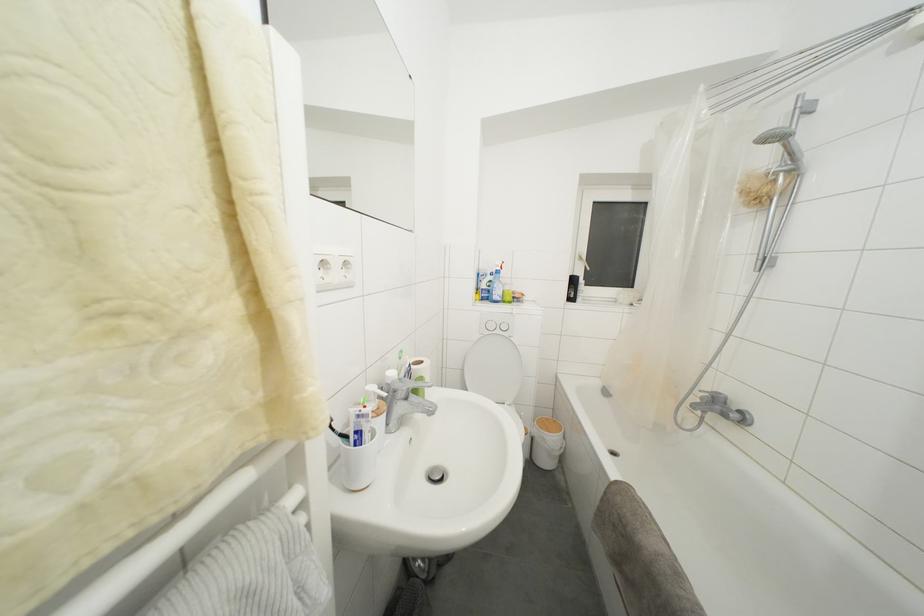
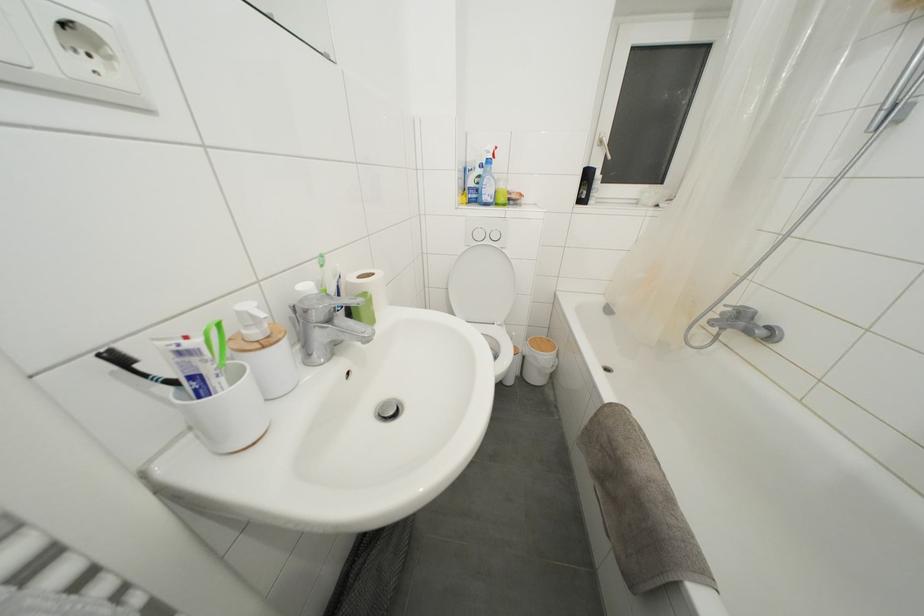
Locate, in the second image, the point that corresponds to point 406,399 in the first image.

(321, 321)